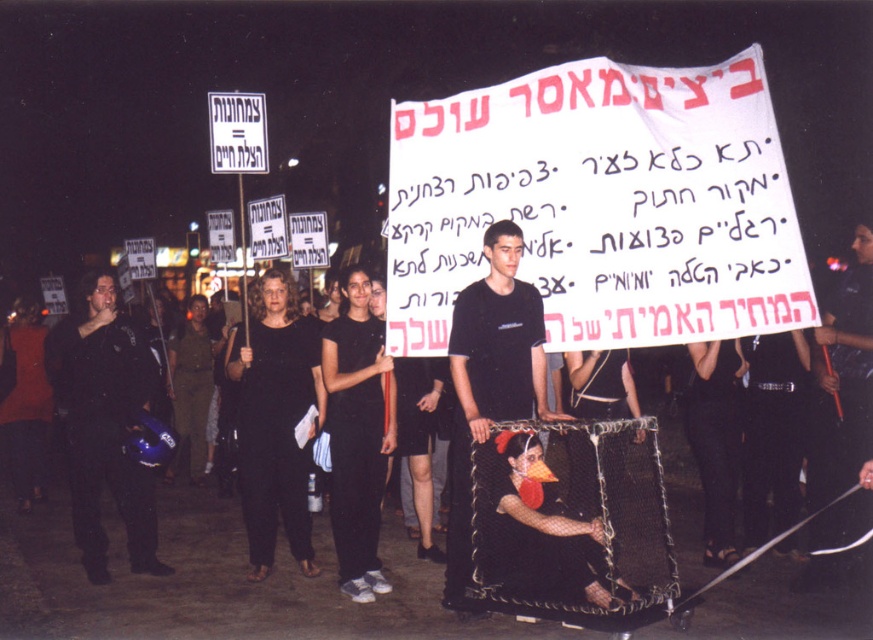
You are a journalist at the protest scene. You need to identify the person holding the largest banner. Which object is closer to the camera between the black matte helmet at left and the black matte shirt at center?

The black matte shirt at center is closer to the camera than the black matte helmet at left because the helmet is positioned under the shirt, indicating it is further away.

You are a photographer standing in the crowd at the nighttime protest. You want to take a photo of both the largest banner held by the man in the black T shirt and the smaller sign held by another participant. The banner is at point (88,481) and the smaller sign is at point (466,436). Which object should you focus on first to ensure both are in focus?

You should focus on the banner at point (88,481) first because it is closer to the camera than the smaller sign at point (466,436). By focusing on the closer object, the depth of field may include the farther one in focus as well.